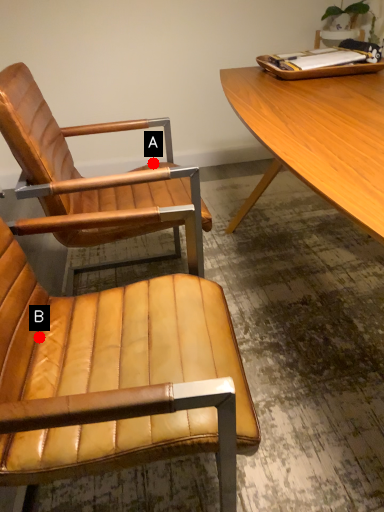
Question: Two points are circled on the image, labeled by A and B beside each circle. Which point is closer to the camera?

Choices:
 (A) A is closer
 (B) B is closer

Answer: (B)